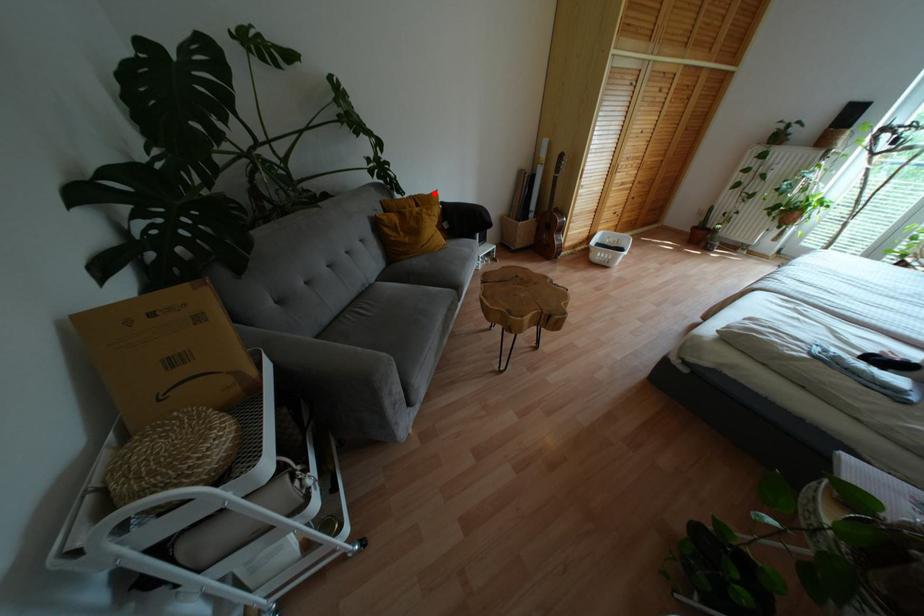
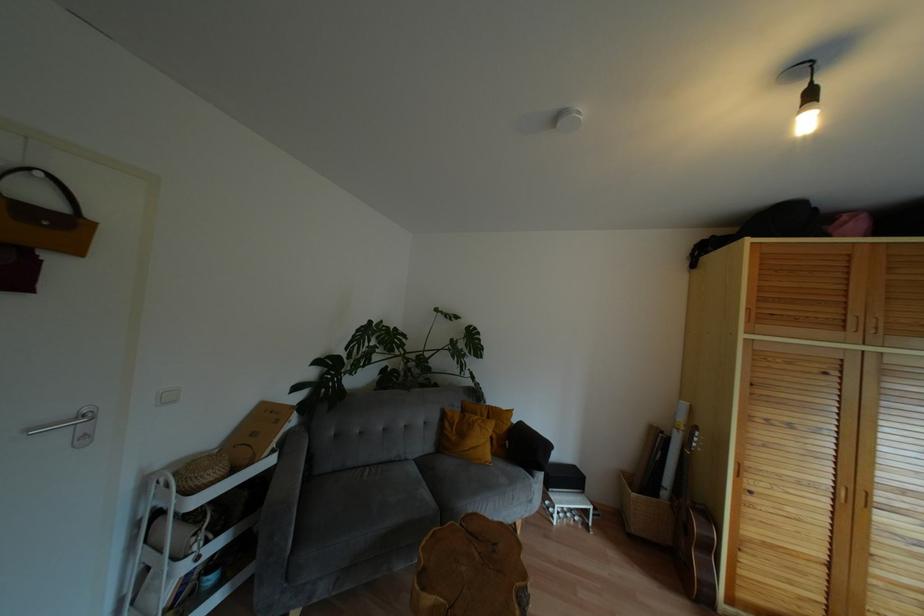
The point at the highlighted location is marked in the first image. Where is the corresponding point in the second image?

(508, 411)